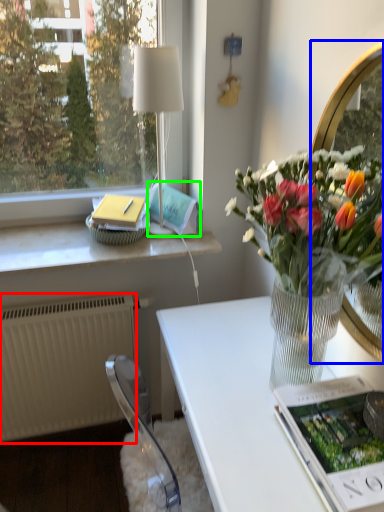
Question: Considering the real-world distances, which object is farthest from radiator (highlighted by a red box)? mirror (highlighted by a blue box) or magazine (highlighted by a green box)?

Choices:
 (A) mirror
 (B) magazine

Answer: (A)